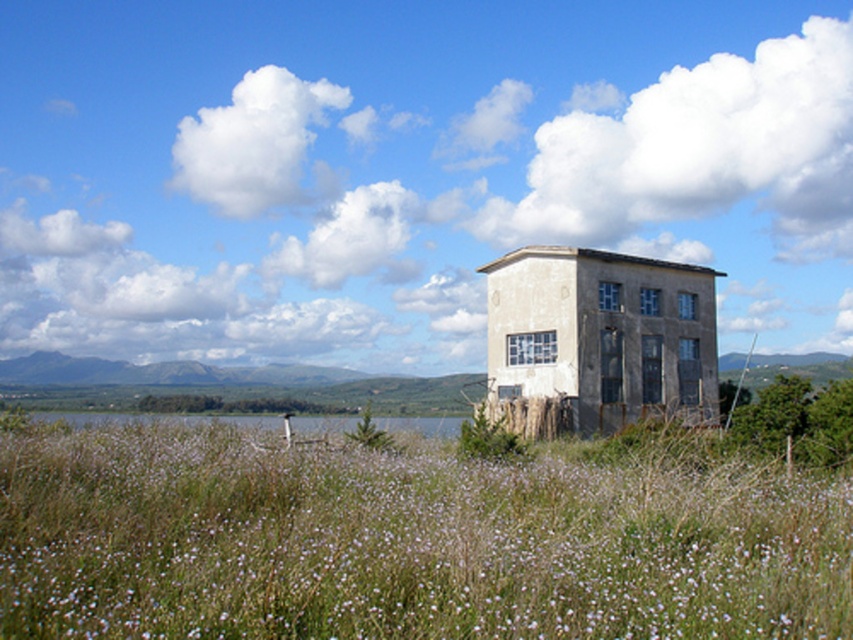
In the scene shown: Who is positioned more to the left, green grass at center or green grass at lower center?

Positioned to the left is green grass at lower center.

Can you confirm if green grass at center is smaller than green grass at lower center?

Indeed, green grass at center has a smaller size compared to green grass at lower center.

The image size is (853, 640). Identify the location of green grass at center. (403, 544).